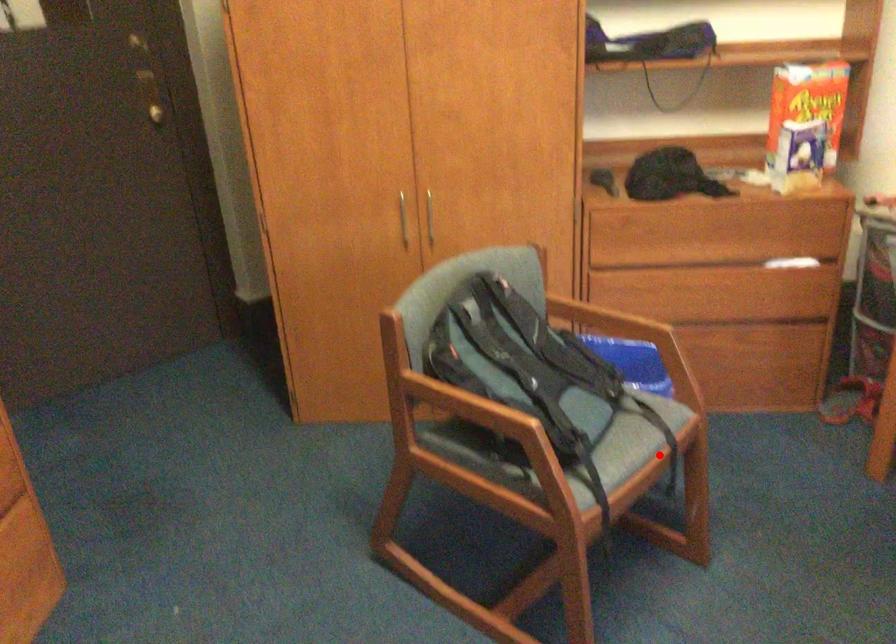
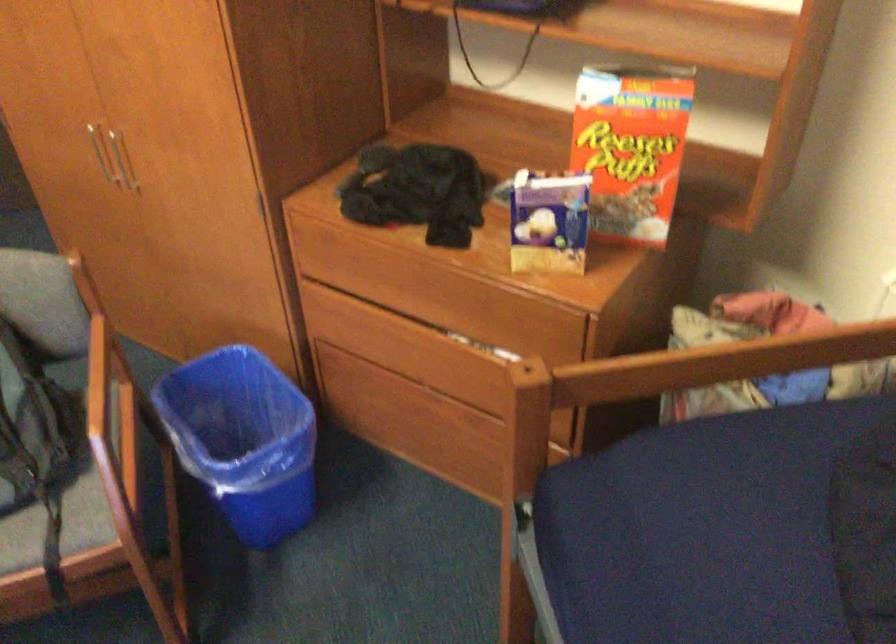
The point at the highlighted location is marked in the first image. Where is the corresponding point in the second image?

(55, 576)